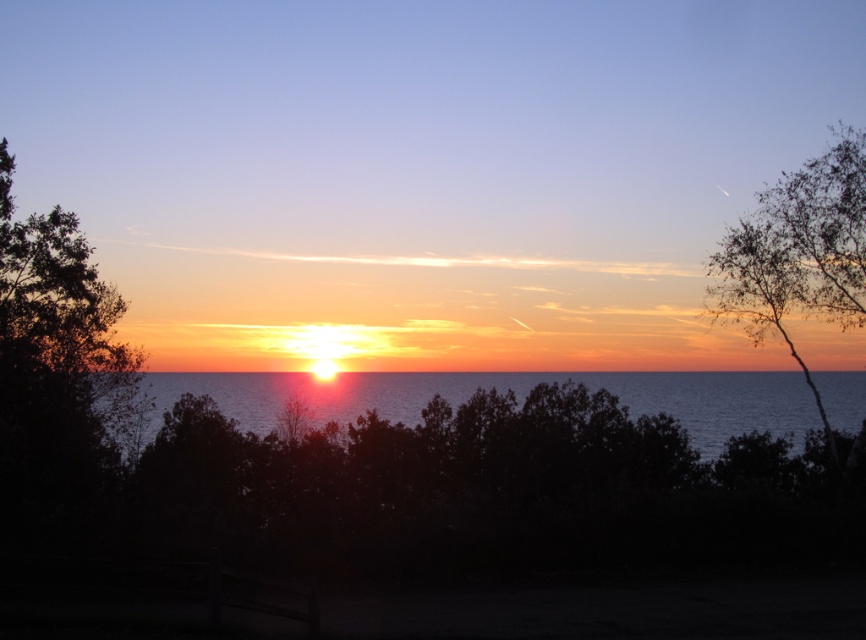
You are standing at the point with coordinates point (855, 173) and want to walk towards the point with coordinates point (658, 394). Since both points are in the image, which direction should you move in to get closer to your destination?

To move towards point (658, 394) from point (855, 173), you should move downward and to the right because point (658, 394) is further towards the camera compared to point (855, 173).